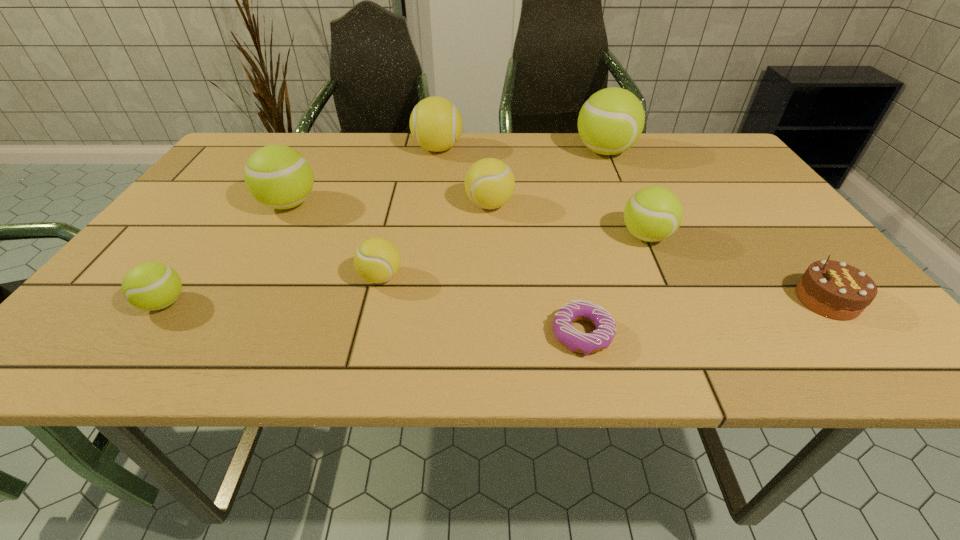
The height and width of the screenshot is (540, 960). In order to click on the farthest green tennis ball in this screenshot , I will do `click(611, 121)`.

The image size is (960, 540). In order to click on the tallest tennis ball in this screenshot , I will do `click(611, 121)`.

The width and height of the screenshot is (960, 540). In order to click on the biggest yellow tennis ball in this screenshot , I will do `click(436, 124)`.

Where is `the sixth tennis ball from right to left`? the sixth tennis ball from right to left is located at coordinates (278, 176).

Where is `the second object from left to right`? Image resolution: width=960 pixels, height=540 pixels. the second object from left to right is located at coordinates (278, 176).

This screenshot has height=540, width=960. In order to click on the fifth object from right to left in this screenshot , I will do (x=489, y=183).

This screenshot has height=540, width=960. Find the location of `the second farthest yellow tennis ball`. the second farthest yellow tennis ball is located at coordinates (489, 183).

Identify the location of the second smallest green tennis ball. (652, 214).

You are a GUI agent. You are given a task and a screenshot of the screen. Output one action in this format:
    pyautogui.click(x=<x>, y=<y>)
    Task: Click on the nearest yellow tennis ball
    
    Given the screenshot: What is the action you would take?
    [x=377, y=260]

Identify the location of the leftmost object. (151, 286).